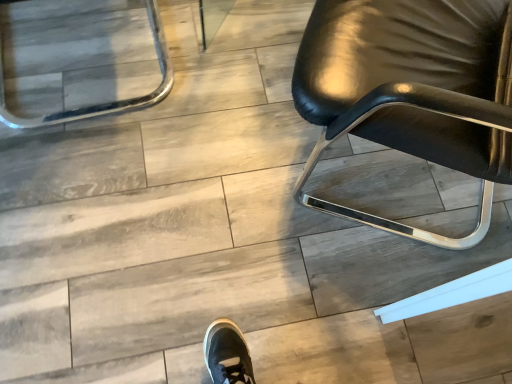
I want to click on vacant area that is situated to the right of clear glass tray at upper left, which is the first chair from left to right, so click(221, 86).